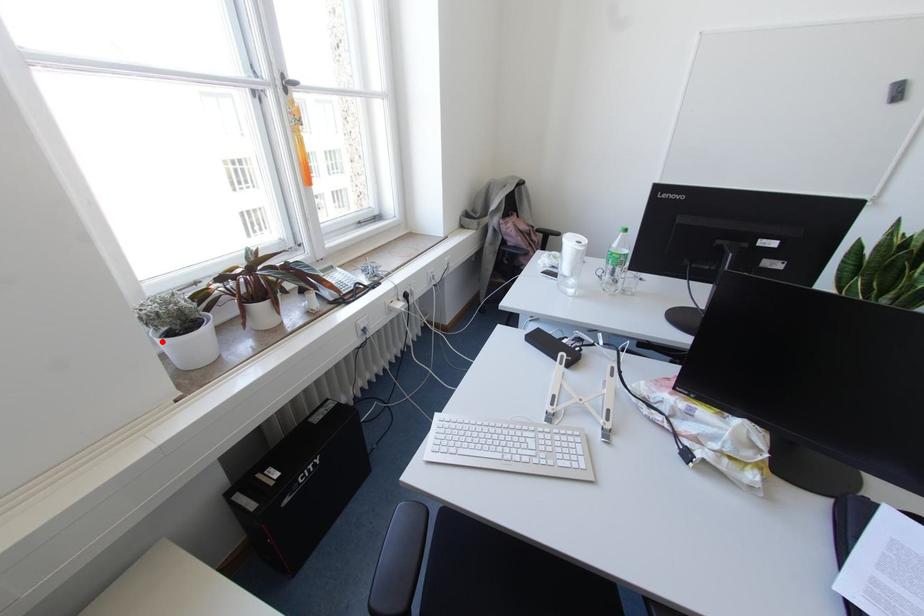
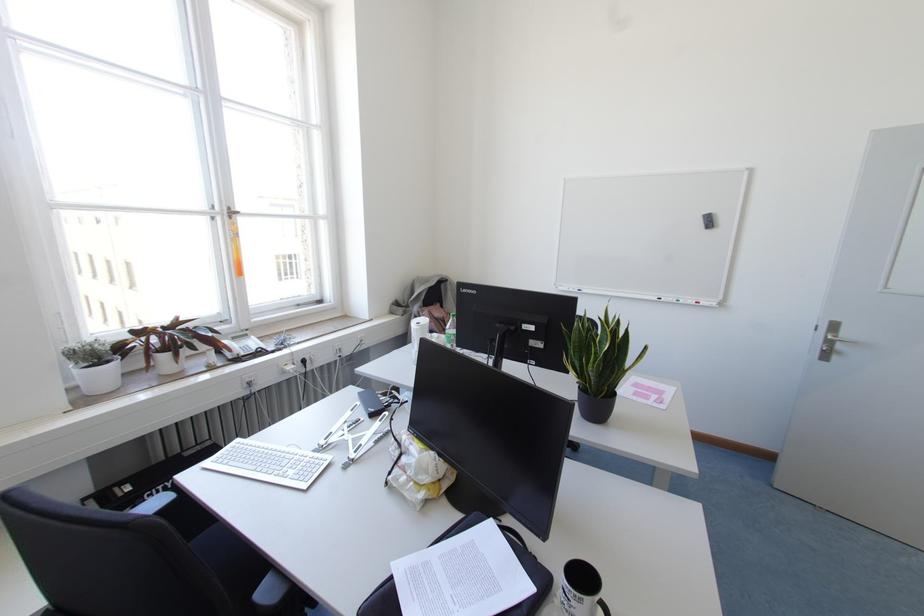
The point at the highlighted location is marked in the first image. Where is the corresponding point in the second image?

(75, 371)